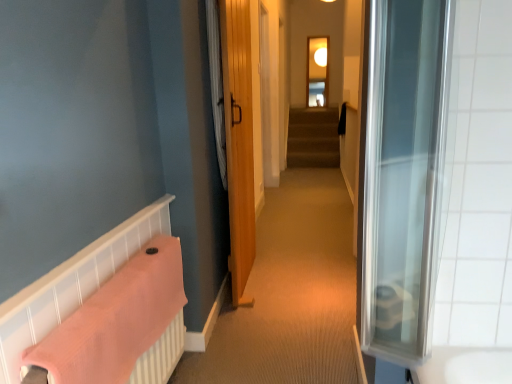
Question: Would you say transparent glass window at upper center is to the left or to the right of pink fabric towel at lower left in the picture?

Choices:
 (A) left
 (B) right

Answer: (B)

Question: From a real-world perspective, is transparent glass window at upper center positioned above or below pink fabric towel at lower left?

Choices:
 (A) above
 (B) below

Answer: (A)

Question: Estimate the real-world distances between objects in this image. Which object is farther from the transparent glass window at upper center?

Choices:
 (A) wooden door at center
 (B) pink fabric towel at lower left
 (C) white fabric shower curtain at center

Answer: (B)

Question: Based on their relative distances, which object is nearer to the wooden door at center?

Choices:
 (A) pink fabric towel at lower left
 (B) white fabric shower curtain at center
 (C) transparent glass window at upper center

Answer: (B)